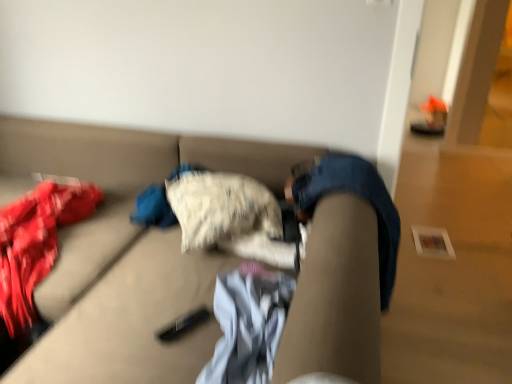
Question: Is white cotton shirt at center wider or thinner than textured beige couch at center?

Choices:
 (A) wide
 (B) thin

Answer: (B)

Question: Is white cotton shirt at center bigger or smaller than textured beige couch at center?

Choices:
 (A) small
 (B) big

Answer: (A)

Question: From the image's perspective, is white cotton shirt at center located above or below textured beige couch at center?

Choices:
 (A) below
 (B) above

Answer: (A)

Question: Considering the positions of textured beige couch at center and white cotton shirt at center in the image, is textured beige couch at center bigger or smaller than white cotton shirt at center?

Choices:
 (A) big
 (B) small

Answer: (A)

Question: In the image, is textured beige couch at center positioned in front of or behind white cotton shirt at center?

Choices:
 (A) front
 (B) behind

Answer: (A)

Question: From their relative heights in the image, would you say textured beige couch at center is taller or shorter than white cotton shirt at center?

Choices:
 (A) short
 (B) tall

Answer: (B)

Question: Is textured beige couch at center inside the boundaries of white cotton shirt at center, or outside?

Choices:
 (A) inside
 (B) outside

Answer: (B)